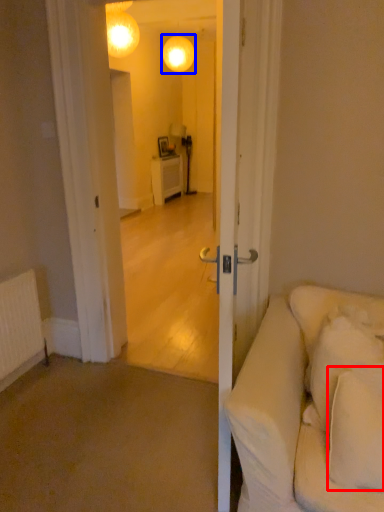
Question: Among these objects, which one is nearest to the camera, pillow (highlighted by a red box) or lamp (highlighted by a blue box)?

Choices:
 (A) pillow
 (B) lamp

Answer: (A)